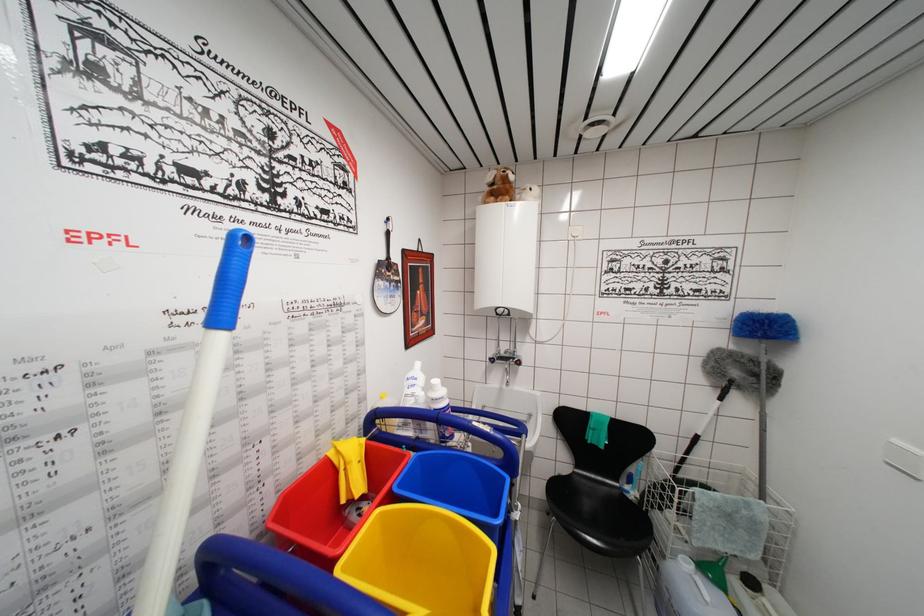
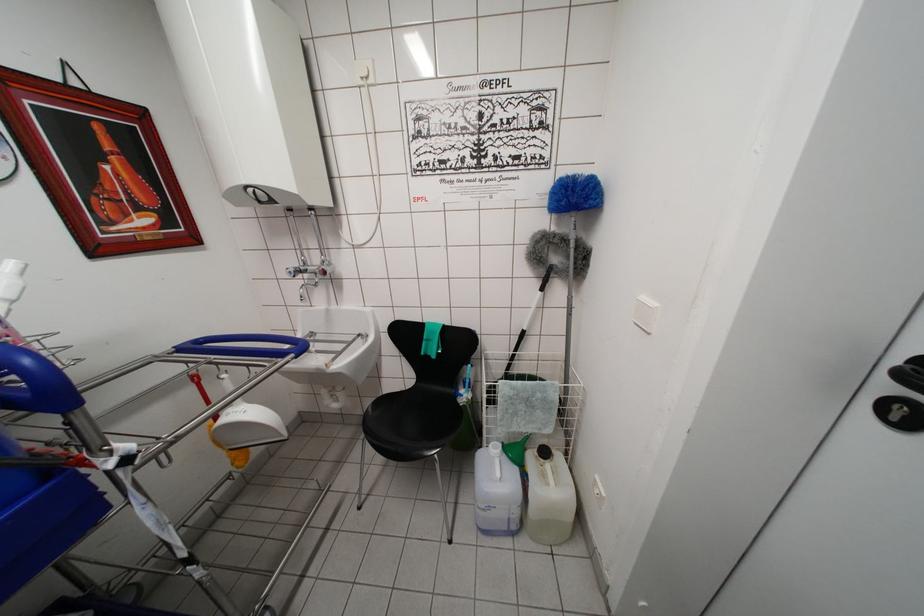
In the second image, find the point that corresponds to point 759,379 in the first image.

(572, 261)